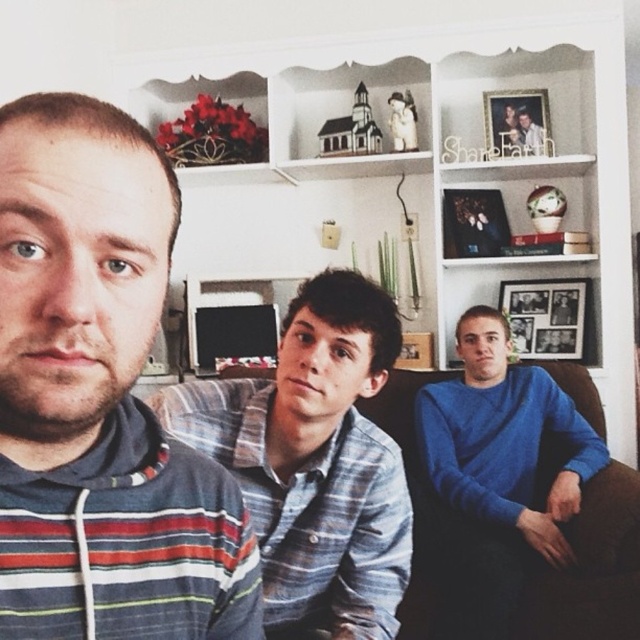
Who is higher up, striped hoodie at left or blue striped shirt at center?

blue striped shirt at center is higher up.

Which is below, striped hoodie at left or blue striped shirt at center?

striped hoodie at left

This screenshot has width=640, height=640. Find the location of `striped hoodie at left`. striped hoodie at left is located at coordinates tap(99, 397).

Identify the location of striped hoodie at left. Image resolution: width=640 pixels, height=640 pixels. (99, 397).

Does plaid shirt at center appear on the left side of wooden photo frame at upper right?

Indeed, plaid shirt at center is positioned on the left side of wooden photo frame at upper right.

Does plaid shirt at center appear under wooden photo frame at upper right?

Correct, plaid shirt at center is located below wooden photo frame at upper right.

Between point (272, 381) and point (544, 132), which one is positioned behind?

The point (544, 132) is behind.

I want to click on plaid shirt at center, so click(314, 460).

Does brown leather couch at right have a lesser width compared to blue striped shirt at center?

Incorrect, brown leather couch at right's width is not less than blue striped shirt at center's.

Is brown leather couch at right closer to the viewer compared to blue striped shirt at center?

Yes, it is in front of blue striped shirt at center.

Locate an element on the screen. This screenshot has height=640, width=640. brown leather couch at right is located at coordinates (589, 568).